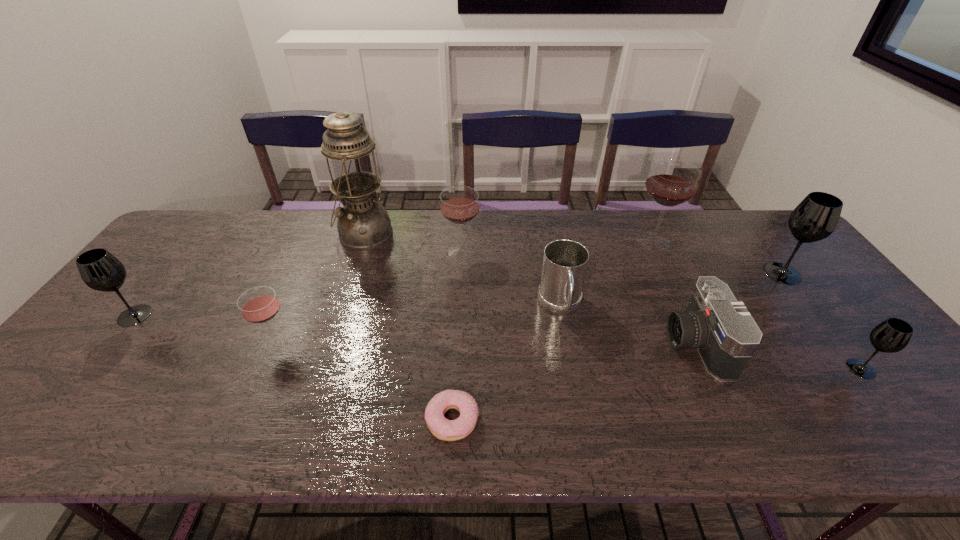
In order to click on the tallest object in this screenshot , I will do `click(363, 224)`.

Where is `the biggest gray wineglass`? This screenshot has width=960, height=540. the biggest gray wineglass is located at coordinates (816, 217).

Image resolution: width=960 pixels, height=540 pixels. Identify the location of the biggest red wineglass. (671, 182).

Find the location of `the fourth wineglass from left to right`. the fourth wineglass from left to right is located at coordinates (671, 182).

This screenshot has height=540, width=960. Identify the location of the fourth wineglass from right to left. pos(459,205).

Where is `the second smallest red wineglass`? This screenshot has height=540, width=960. the second smallest red wineglass is located at coordinates (459, 205).

Where is `the leftmost object`? The height and width of the screenshot is (540, 960). the leftmost object is located at coordinates (100, 270).

Find the location of a particular element. This screenshot has width=960, height=540. the leftmost wineglass is located at coordinates (100, 270).

Locate an element on the screen. The height and width of the screenshot is (540, 960). mug is located at coordinates (564, 265).

Where is `the fifth object from right to left`? The height and width of the screenshot is (540, 960). the fifth object from right to left is located at coordinates (564, 265).